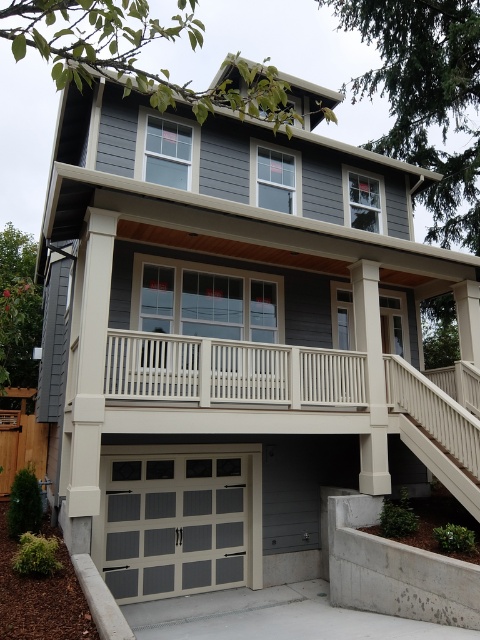
Is matte gray panel garage door at lower center to the left of gray concrete driveway at lower center from the viewer's perspective?

Correct, you'll find matte gray panel garage door at lower center to the left of gray concrete driveway at lower center.

Is matte gray panel garage door at lower center taller than gray concrete driveway at lower center?

Indeed, matte gray panel garage door at lower center has a greater height compared to gray concrete driveway at lower center.

What do you see at coordinates (180, 524) in the screenshot? I see `matte gray panel garage door at lower center` at bounding box center [180, 524].

This screenshot has width=480, height=640. Find the location of `matte gray panel garage door at lower center`. matte gray panel garage door at lower center is located at coordinates (180, 524).

Between matte gray panel garage door at lower center and white textured stairs at lower right, which one appears on the right side from the viewer's perspective?

white textured stairs at lower right

Which of these two, matte gray panel garage door at lower center or white textured stairs at lower right, stands taller?

With more height is matte gray panel garage door at lower center.

Between point (121, 548) and point (466, 474), which one is positioned in front?

Point (466, 474) is in front.

Locate an element on the screen. matte gray panel garage door at lower center is located at coordinates (180, 524).

Between gray concrete driveway at lower center and white textured stairs at lower right, which one appears on the left side from the viewer's perspective?

Positioned to the left is gray concrete driveway at lower center.

The height and width of the screenshot is (640, 480). What are the coordinates of `gray concrete driveway at lower center` in the screenshot? It's located at (274, 618).